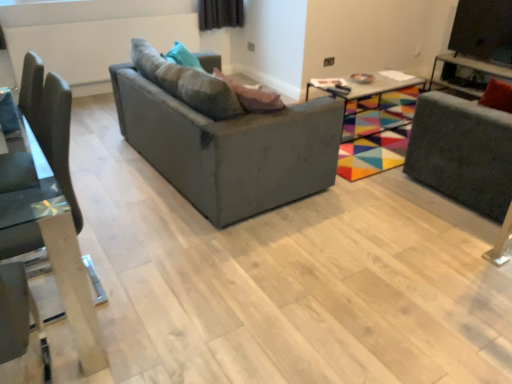
Locate an element on the screen. The image size is (512, 384). vacant space that is in between matte gray couch at center and transparent glass chair at left is located at coordinates (151, 224).